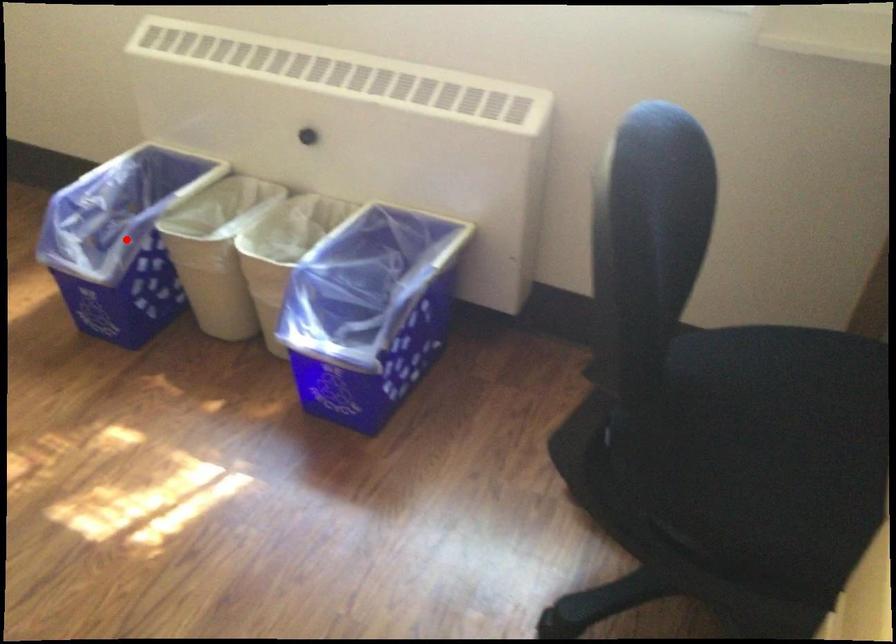
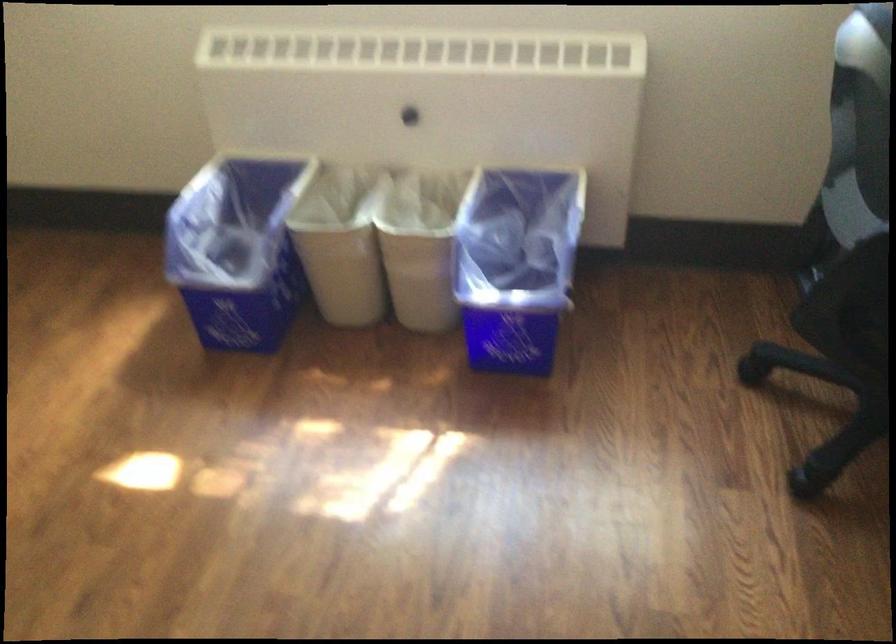
Question: I am providing you with two images of the same scene from different viewpoints. Given a red point in image1, look at the same physical point in image2. Is it:

Choices:
 (A) Closer to the viewpoint
 (B) Farther from the viewpoint

Answer: (B)